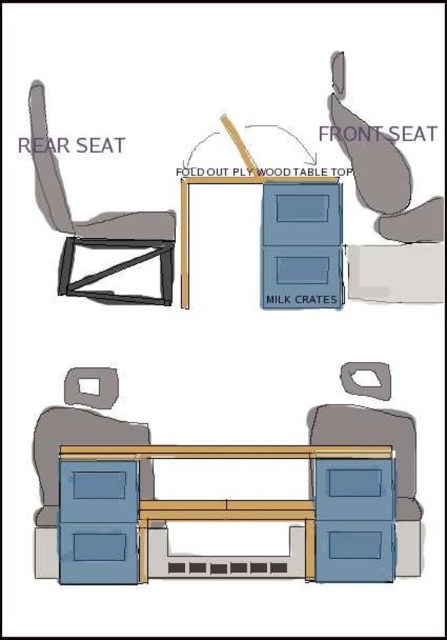
You are setting up a workspace and need to place a 10cm wide plant pot between the matte gray swivel chair at lower center and the wooden table top at center. Can the plant pot fit in the space between them?

The matte gray swivel chair at lower center is thinner than the wooden table top at center, so there should be enough space to place the 10cm wide plant pot between them.

You are designing a layout for a small apartment and want to place the matte gray chair at rear and the wooden table top at center in the same room. Considering their sizes, which object will require more floor space?

The matte gray chair at rear is bigger than the wooden table top at center, so it will require more floor space.

You are organizing a small gathering in this workspace and need to place a large rectangular cake on the available surfaces. Which object between the blue matte cabinet at center and the matte gray chair at rear would be more suitable for placing the cake?

The blue matte cabinet at center is bigger than the matte gray chair at rear, so it would provide a more stable and spacious surface for placing the large rectangular cake.